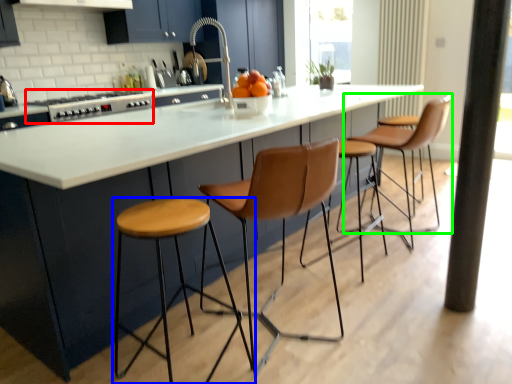
Question: Estimate the real-world distances between objects in this image. Which object is closer to appliance (highlighted by a red box), stool (highlighted by a blue box) or chair (highlighted by a green box)?

Choices:
 (A) stool
 (B) chair

Answer: (A)